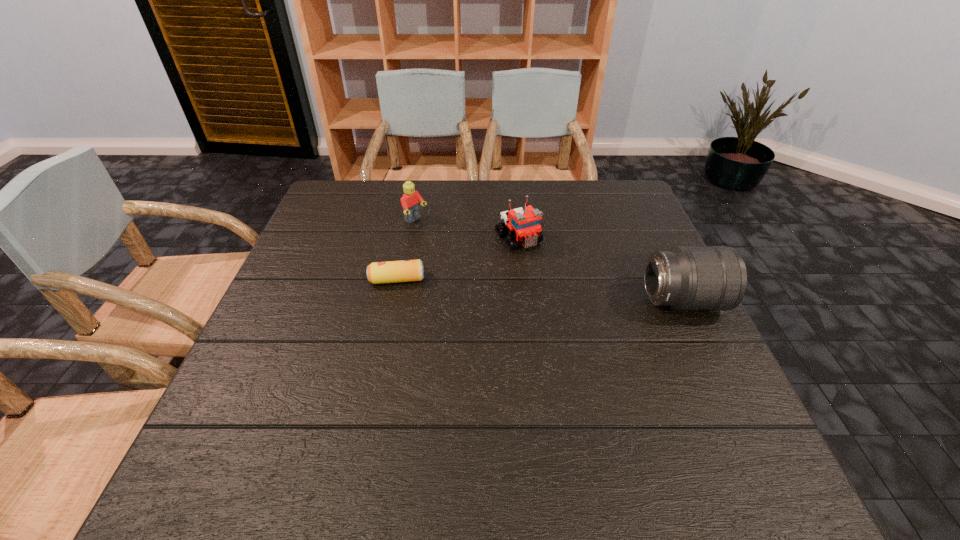
Locate an element on the screen. This screenshot has width=960, height=540. blank area located 0.330m on the front-facing side of the right Lego is located at coordinates (603, 343).

Identify the location of free space located on the front-facing side of the right Lego. (623, 367).

At what (x,y) coordinates should I click in order to perform the action: click on object located at the far edge. Please return your answer as a coordinate pair (x, y). Looking at the image, I should click on (410, 201).

Locate an element on the screen. object located at the right edge is located at coordinates (714, 278).

The image size is (960, 540). I want to click on free space at the far edge, so click(398, 205).

You are a GUI agent. You are given a task and a screenshot of the screen. Output one action in this format:
    pyautogui.click(x=<x>, y=<y>)
    Task: Click on the vacant space at the near edge of the desktop
    
    Given the screenshot: What is the action you would take?
    pyautogui.click(x=316, y=414)

Where is `free space at the left edge of the desktop`? The image size is (960, 540). free space at the left edge of the desktop is located at coordinates (290, 286).

Identify the location of vacant space at the right edge of the desktop. (727, 387).

This screenshot has height=540, width=960. In order to click on vacant space at the far left corner of the desktop in this screenshot , I will do `click(373, 194)`.

Locate an element on the screen. This screenshot has height=540, width=960. vacant area at the far right corner of the desktop is located at coordinates (609, 183).